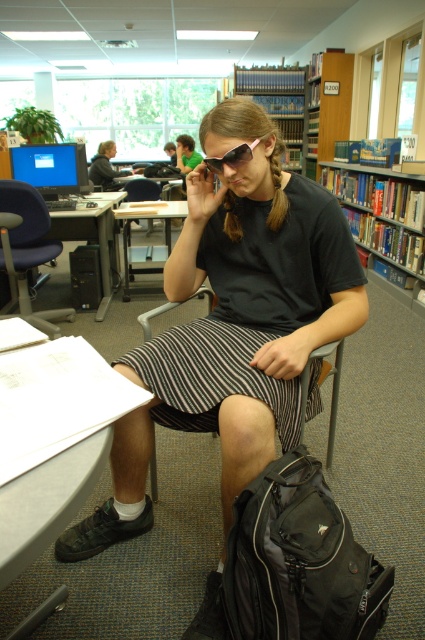
You are a librarian who needs to adjust the seating for a visitor who uses a wheelchair. The visitor requires a table and chair of equal height. Looking at the black plastic table at left and the black fabric chair at center, which object should be adjusted to match the other in height?

The black plastic table at left is much taller than the black fabric chair at center. To make them equal, the table should be lowered or the chair should be raised to match each other.

You are a library visitor who wants to sit down at the desk. You are currently standing behind the black plastic table at left. To reach the black fabric chair at center, should you walk forward or backward?

The black fabric chair at center is behind the black plastic table at left, so to reach it from behind the table, you should walk backward towards the chair.